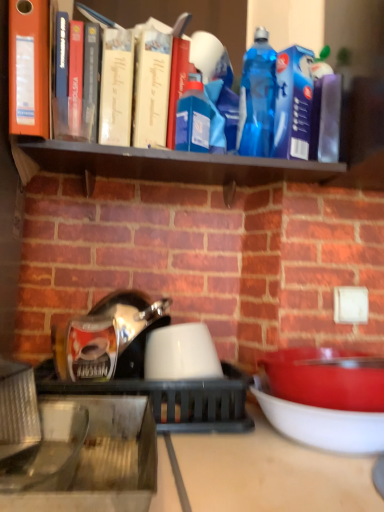
Image resolution: width=384 pixels, height=512 pixels. What are the coordinates of `white glossy kettle at center` in the screenshot? It's located at (140, 368).

What do you see at coordinates (140, 368) in the screenshot? Image resolution: width=384 pixels, height=512 pixels. I see `white glossy kettle at center` at bounding box center [140, 368].

What do you see at coordinates (181, 353) in the screenshot? This screenshot has height=512, width=384. I see `white glossy bowl at center, the 3th bowl viewed from the right` at bounding box center [181, 353].

Identify the location of matte white bowl at lower right, which is the 3th bowl from left to right. (321, 423).

Locate an element on the screen. Image resolution: width=384 pixels, height=512 pixels. black matte shelf at upper center is located at coordinates (163, 164).

This screenshot has height=512, width=384. What do you see at coordinates (163, 164) in the screenshot? I see `black matte shelf at upper center` at bounding box center [163, 164].

Identify the location of matte red bowl at right, the second bowl when ordered from left to right. This screenshot has height=512, width=384. (326, 378).

Does matte red bowl at right, the second bowl when ordered from left to right, turn towards matte white bowl at lower right, which is the 3th bowl from left to right?

No.

Is point (310, 403) positioned after point (375, 420)?

Yes, it is.

From the image's perspective, is matte red bowl at right, the second bowl when ordered from left to right, located beneath matte white bowl at lower right, which is the 3th bowl from left to right?

Actually, matte red bowl at right, the second bowl when ordered from left to right, appears above matte white bowl at lower right, which is the 3th bowl from left to right, in the image.

Does black matte shelf at upper center have a lesser height compared to matte red bowl at right, the 2th bowl when ordered from right to left?

Correct, black matte shelf at upper center is not as tall as matte red bowl at right, the 2th bowl when ordered from right to left.

From a real-world perspective, between black matte shelf at upper center and matte red bowl at right, the second bowl when ordered from left to right, who is vertically higher?

From a 3D spatial view, black matte shelf at upper center is above.

Is black matte shelf at upper center turned away from matte red bowl at right, the second bowl when ordered from left to right?

No.

Can you confirm if white glossy bowl at center, the 3th bowl viewed from the right, is thinner than black matte shelf at upper center?

Yes.

Looking at this image, is white glossy bowl at center, acting as the 1th bowl starting from the left, looking in the opposite direction of black matte shelf at upper center?

No.

Is white glossy bowl at center, acting as the 1th bowl starting from the left, to the left of black matte shelf at upper center from the viewer's perspective?

Yes.

Is white glossy bowl at center, acting as the 1th bowl starting from the left, not near black matte shelf at upper center?

They are positioned close to each other.

At what (x,y) coordinates should I click in order to perform the action: click on shelf positioned vertically above the matte white bowl at lower right, the 1th bowl when ordered from right to left (from a real-world perspective). Please return your answer as a coordinate pair (x, y). Looking at the image, I should click on (163, 164).

From a real-world perspective, is matte white bowl at lower right, which is the 3th bowl from left to right, located beneath black matte shelf at upper center?

Yes, from a real-world perspective, matte white bowl at lower right, which is the 3th bowl from left to right, is beneath black matte shelf at upper center.

Is matte white bowl at lower right, which is the 3th bowl from left to right, smaller than black matte shelf at upper center?

Actually, matte white bowl at lower right, which is the 3th bowl from left to right, might be larger than black matte shelf at upper center.

Between point (279, 425) and point (128, 155), which one is positioned in front?

The point (279, 425) is closer to the camera.

Between black matte shelf at upper center and matte white bowl at lower right, the 1th bowl when ordered from right to left, which one appears on the left side from the viewer's perspective?

black matte shelf at upper center.

Is black matte shelf at upper center looking in the opposite direction of matte white bowl at lower right, the 1th bowl when ordered from right to left?

black matte shelf at upper center is not turned away from matte white bowl at lower right, the 1th bowl when ordered from right to left.

Which of these two, black matte shelf at upper center or matte white bowl at lower right, the 1th bowl when ordered from right to left, is thinner?

Result: black matte shelf at upper center is thinner.

Who is taller, black matte shelf at upper center or matte white bowl at lower right, the 1th bowl when ordered from right to left?

matte white bowl at lower right, the 1th bowl when ordered from right to left, is taller.

Considering the sizes of objects white glossy kettle at center and white glossy bowl at center, acting as the 1th bowl starting from the left, in the image provided, who is taller, white glossy kettle at center or white glossy bowl at center, acting as the 1th bowl starting from the left,?

Standing taller between the two is white glossy bowl at center, acting as the 1th bowl starting from the left.

From the picture: Would you consider white glossy kettle at center to be distant from white glossy bowl at center, the 3th bowl viewed from the right?

No, white glossy kettle at center is not far away from white glossy bowl at center, the 3th bowl viewed from the right.

From a real-world perspective, which is physically below, white glossy kettle at center or white glossy bowl at center, the 3th bowl viewed from the right?

white glossy kettle at center, from a real-world perspective.

Which object is positioned more to the right, white glossy kettle at center or white glossy bowl at center, acting as the 1th bowl starting from the left?

white glossy bowl at center, acting as the 1th bowl starting from the left, is more to the right.

From the image's perspective, between black matte shelf at upper center and white glossy bowl at center, acting as the 1th bowl starting from the left, which one is located above?

From the image's view, black matte shelf at upper center is above.

Which point is more distant from viewer, [159,164] or [161,371]?

The point [159,164] is more distant.

Between black matte shelf at upper center and white glossy bowl at center, acting as the 1th bowl starting from the left, which one has smaller width?

white glossy bowl at center, acting as the 1th bowl starting from the left.

Which is in front, black matte shelf at upper center or white glossy bowl at center, acting as the 1th bowl starting from the left?

black matte shelf at upper center is in front.

The height and width of the screenshot is (512, 384). In the image, there is a matte red bowl at right, the second bowl when ordered from left to right. What are the coordinates of `bowl below it (from a real-world perspective)` in the screenshot? It's located at click(x=321, y=423).

This screenshot has width=384, height=512. What are the coordinates of `shelf that is behind the matte red bowl at right, the 2th bowl when ordered from right to left` in the screenshot? It's located at (163, 164).

Based on the photo, which object lies further to the anchor point matte white bowl at lower right, which is the 3th bowl from left to right, white glossy kettle at center or black matte shelf at upper center?

black matte shelf at upper center lies further to matte white bowl at lower right, which is the 3th bowl from left to right, than the other object.

Looking at the image, which one is located closer to matte red bowl at right, the second bowl when ordered from left to right, white glossy kettle at center or matte white bowl at lower right, the 1th bowl when ordered from right to left?

matte white bowl at lower right, the 1th bowl when ordered from right to left.

Looking at the image, which one is located closer to white glossy bowl at center, acting as the 1th bowl starting from the left, white glossy kettle at center or matte white bowl at lower right, the 1th bowl when ordered from right to left?

Based on the image, white glossy kettle at center appears to be nearer to white glossy bowl at center, acting as the 1th bowl starting from the left.

Based on their spatial positions, is matte red bowl at right, the 2th bowl when ordered from right to left, or white glossy kettle at center closer to matte white bowl at lower right, which is the 3th bowl from left to right?

Based on the image, matte red bowl at right, the 2th bowl when ordered from right to left, appears to be nearer to matte white bowl at lower right, which is the 3th bowl from left to right.

Considering their positions, is white glossy bowl at center, the 3th bowl viewed from the right, positioned further to white glossy kettle at center than matte white bowl at lower right, the 1th bowl when ordered from right to left?

matte white bowl at lower right, the 1th bowl when ordered from right to left, lies further to white glossy kettle at center than the other object.

Based on their spatial positions, is matte white bowl at lower right, the 1th bowl when ordered from right to left, or white glossy bowl at center, the 3th bowl viewed from the right, further from matte red bowl at right, the 2th bowl when ordered from right to left?

white glossy bowl at center, the 3th bowl viewed from the right, lies further to matte red bowl at right, the 2th bowl when ordered from right to left, than the other object.

From the image, which object appears to be nearer to white glossy kettle at center, matte white bowl at lower right, which is the 3th bowl from left to right, or white glossy bowl at center, acting as the 1th bowl starting from the left?

white glossy bowl at center, acting as the 1th bowl starting from the left, is closer to white glossy kettle at center.

Estimate the real-world distances between objects in this image. Which object is further from white glossy kettle at center, matte red bowl at right, the 2th bowl when ordered from right to left, or white glossy bowl at center, acting as the 1th bowl starting from the left?

Among the two, matte red bowl at right, the 2th bowl when ordered from right to left, is located further to white glossy kettle at center.

You are a GUI agent. You are given a task and a screenshot of the screen. Output one action in this format:
    pyautogui.click(x=<x>, y=<y>)
    Task: Click on the appliance between black matte shelf at upper center and matte white bowl at lower right, which is the 3th bowl from left to right, vertically
    The height and width of the screenshot is (512, 384).
    Given the screenshot: What is the action you would take?
    pyautogui.click(x=140, y=368)

Locate an element on the screen. Image resolution: width=384 pixels, height=512 pixels. bowl situated between white glossy bowl at center, the 3th bowl viewed from the right, and matte white bowl at lower right, the 1th bowl when ordered from right to left, from left to right is located at coordinates (326, 378).

This screenshot has height=512, width=384. What are the coordinates of `bowl between black matte shelf at upper center and matte red bowl at right, the 2th bowl when ordered from right to left, in the vertical direction` in the screenshot? It's located at (181, 353).

Find the location of a particular element. Image resolution: width=384 pixels, height=512 pixels. bowl between white glossy kettle at center and matte red bowl at right, the 2th bowl when ordered from right to left is located at coordinates (181, 353).